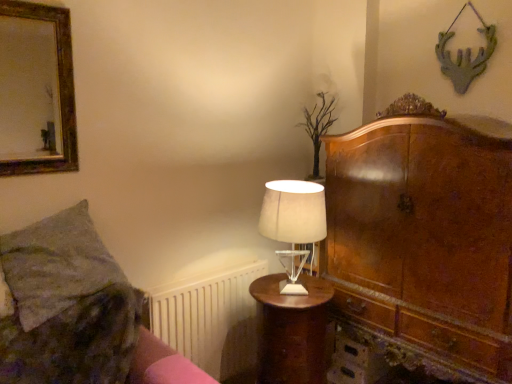
Find the location of a particular element. vacant area on top of pink fabric bed frame at lower left (from a real-world perspective) is located at coordinates (180, 370).